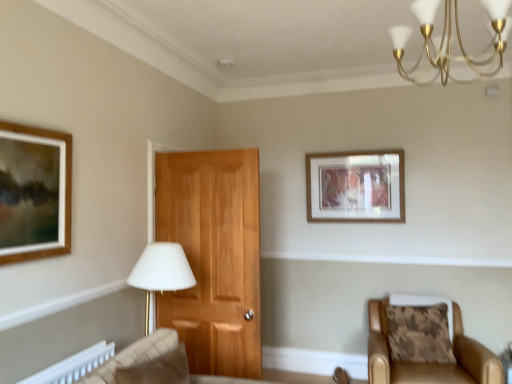
Question: Are wooden picture frame at upper center and gold metallic chandelier at upper right located far from each other?

Choices:
 (A) no
 (B) yes

Answer: (B)

Question: Is wooden picture frame at upper center thinner than gold metallic chandelier at upper right?

Choices:
 (A) yes
 (B) no

Answer: (A)

Question: Is wooden picture frame at upper center oriented towards gold metallic chandelier at upper right?

Choices:
 (A) yes
 (B) no

Answer: (A)

Question: From a real-world perspective, is wooden picture frame at upper center located beneath gold metallic chandelier at upper right?

Choices:
 (A) yes
 (B) no

Answer: (A)

Question: Is wooden picture frame at upper center wider than gold metallic chandelier at upper right?

Choices:
 (A) no
 (B) yes

Answer: (A)

Question: In terms of height, does leather armchair at lower right look taller or shorter compared to wooden picture frame at upper center?

Choices:
 (A) tall
 (B) short

Answer: (A)

Question: In terms of width, does leather armchair at lower right look wider or thinner when compared to wooden picture frame at upper center?

Choices:
 (A) thin
 (B) wide

Answer: (B)

Question: Relative to wooden picture frame at upper center, is leather armchair at lower right in front or behind?

Choices:
 (A) front
 (B) behind

Answer: (A)

Question: Visually, is leather armchair at lower right positioned to the left or to the right of wooden picture frame at upper center?

Choices:
 (A) left
 (B) right

Answer: (B)

Question: From the image's perspective, is brown textured pillow at lower right positioned above or below wooden picture frame at upper center?

Choices:
 (A) above
 (B) below

Answer: (B)

Question: From their relative heights in the image, would you say brown textured pillow at lower right is taller or shorter than wooden picture frame at upper center?

Choices:
 (A) tall
 (B) short

Answer: (B)

Question: Choose the correct answer: Is brown textured pillow at lower right inside wooden picture frame at upper center or outside it?

Choices:
 (A) outside
 (B) inside

Answer: (A)

Question: In the image, is brown textured pillow at lower right positioned in front of or behind wooden picture frame at upper center?

Choices:
 (A) front
 (B) behind

Answer: (A)

Question: From their relative heights in the image, would you say brown textured pillow at lower right is taller or shorter than leather armchair at lower right?

Choices:
 (A) tall
 (B) short

Answer: (B)

Question: Do you think brown textured pillow at lower right is within leather armchair at lower right, or outside of it?

Choices:
 (A) outside
 (B) inside

Answer: (B)